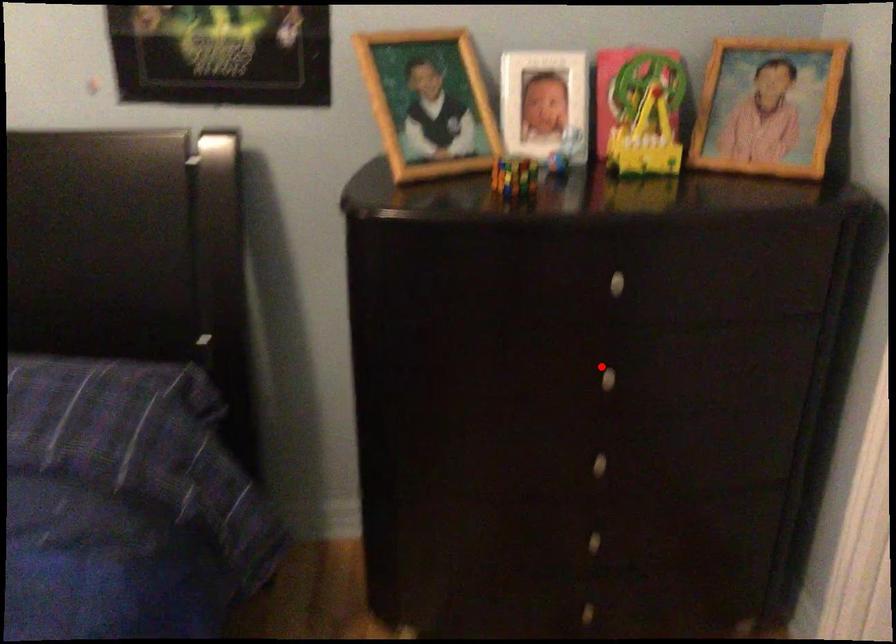
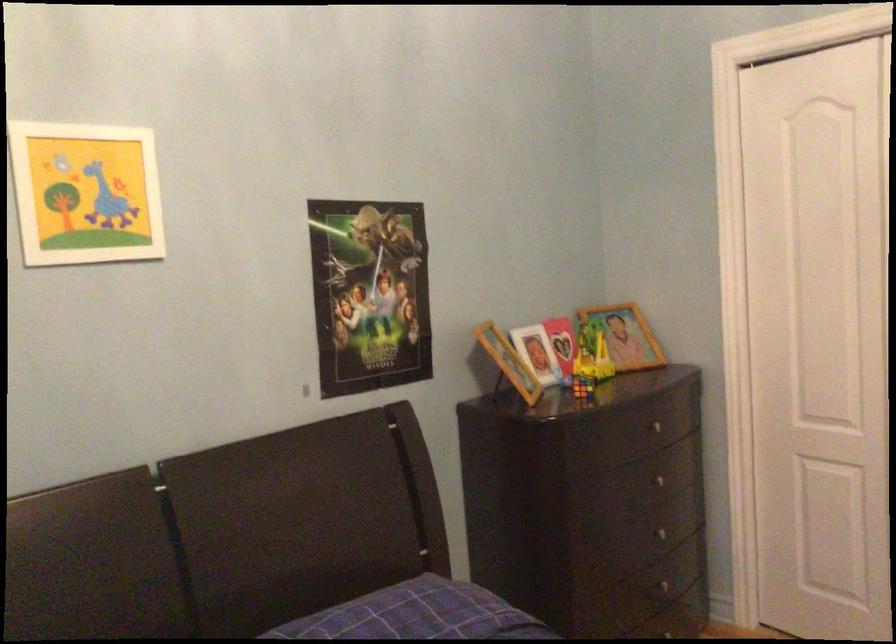
In the second image, find the point that corresponds to the highlighted location in the first image.

(656, 480)